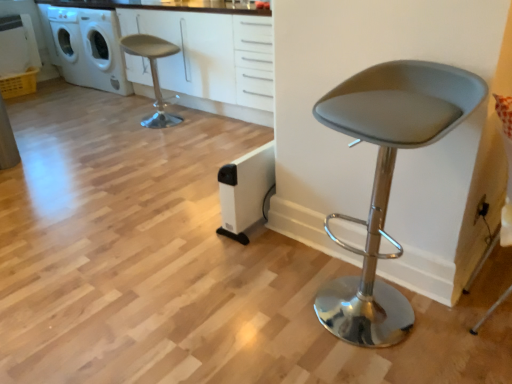
Question: Is point (227, 34) closer or farther from the camera than point (79, 36)?

Choices:
 (A) closer
 (B) farther

Answer: (A)

Question: From the image's perspective, is white matte cabinet at upper center located above or below white plastic washing machine at upper left?

Choices:
 (A) below
 (B) above

Answer: (A)

Question: Which of these objects is positioned closest to the matte gray stool at center, positioned as the 1th chair in front-to-back order?

Choices:
 (A) white plastic washing machine at upper left
 (B) matte gray stool at upper left, which is the first chair from top to bottom
 (C) white matte cabinet at upper center

Answer: (C)

Question: Based on their relative distances, which object is nearer to the white plastic washing machine at upper left?

Choices:
 (A) matte gray stool at center, positioned as the second chair in top-to-bottom order
 (B) white matte cabinet at upper center
 (C) matte gray stool at upper left, marked as the second chair in a front-to-back arrangement

Answer: (B)